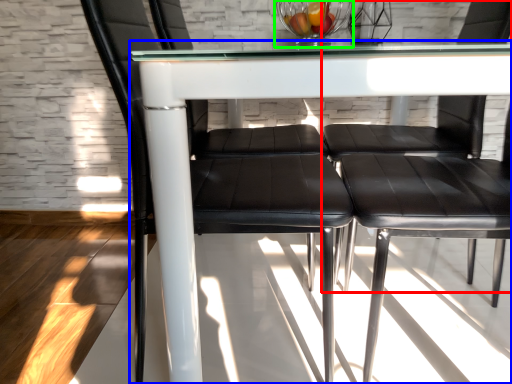
Question: Which object is positioned farthest from chair (highlighted by a red box)? Select from table (highlighted by a blue box) and glass bowl (highlighted by a green box).

Choices:
 (A) table
 (B) glass bowl

Answer: (A)